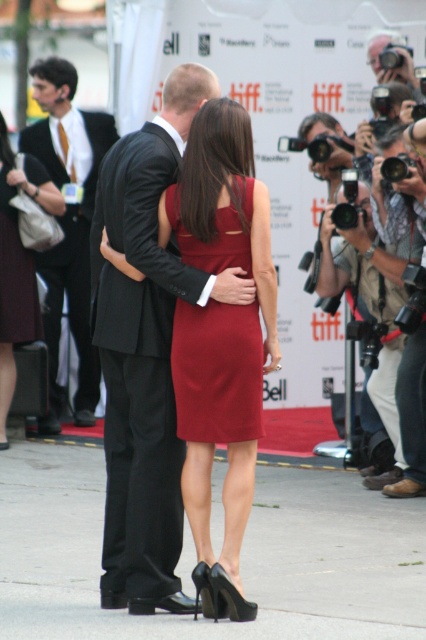
You are a photographer at the event and need to capture a photo of both the satin red dress at center and the matte burgundy dress at left. Your camera has a maximum focus range of 5 meters. Can you fit both dresses in the same frame without moving closer?

The satin red dress at center is 4.99 meters away from the matte burgundy dress at left. Since the distance between them is just under 5 meters, the camera can capture both dresses in the same frame without moving closer.

You are standing at the origin point in the image and want to locate the black satin suit at center. Which direction should you move to find it?

The black satin suit at center is located at point 0.586 on the x axis and 0.329 on the y axis, so you should move to the right and slightly upwards from the origin point to reach it.